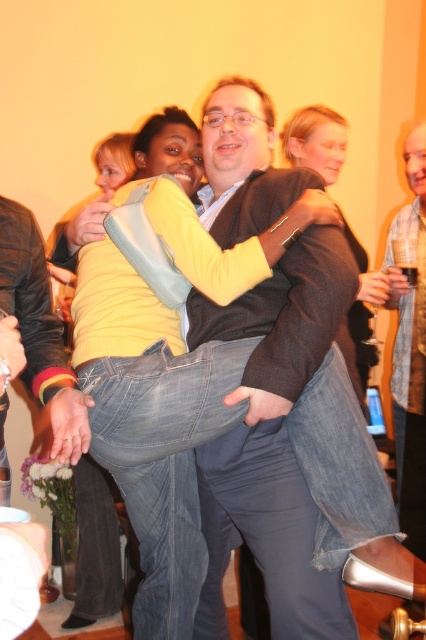
Can you confirm if denim jeans at center is taller than matte brown jacket at upper right?

Yes, denim jeans at center is taller than matte brown jacket at upper right.

Locate an element on the screen. This screenshot has width=426, height=640. denim jeans at center is located at coordinates (118, 204).

Between plaid shirt at center and matte brown jacket at upper right, which one has more height?

plaid shirt at center is taller.

Is plaid shirt at center to the left of matte brown jacket at upper right from the viewer's perspective?

In fact, plaid shirt at center is to the right of matte brown jacket at upper right.

Locate an element on the screen. This screenshot has width=426, height=640. plaid shirt at center is located at coordinates (409, 349).

Where is `plaid shirt at center`? plaid shirt at center is located at coordinates (409, 349).

The image size is (426, 640). Describe the element at coordinates (273, 440) in the screenshot. I see `matte brown sweater at center` at that location.

Between matte brown sweater at center and denim jeans at center, which one is positioned lower?

matte brown sweater at center

Who is more distant from viewer, (261, 90) or (166, 134)?

The point (166, 134) is more distant.

The width and height of the screenshot is (426, 640). Find the location of `matte brown sweater at center`. matte brown sweater at center is located at coordinates (273, 440).